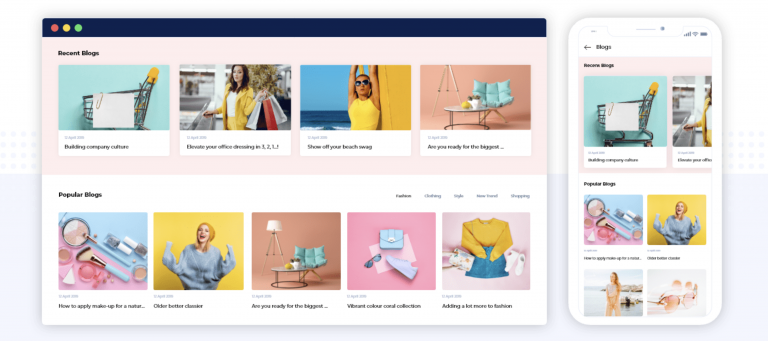
The width and height of the screenshot is (768, 341). I want to click on chair, so click(x=313, y=251).